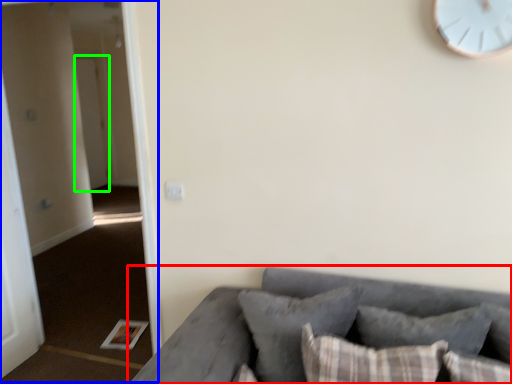
Question: Based on their relative distances, which object is nearer to studio couch (highlighted by a red box)? Choose from corridor (highlighted by a blue box) and door (highlighted by a green box).

Choices:
 (A) corridor
 (B) door

Answer: (A)